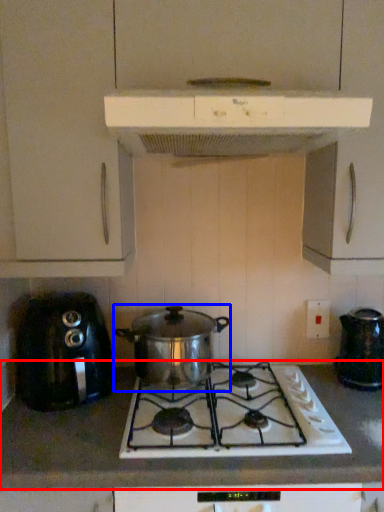
Question: Which point is further to the camera, countertop (highlighted by a red box) or kitchen appliance (highlighted by a blue box)?

Choices:
 (A) countertop
 (B) kitchen appliance

Answer: (B)